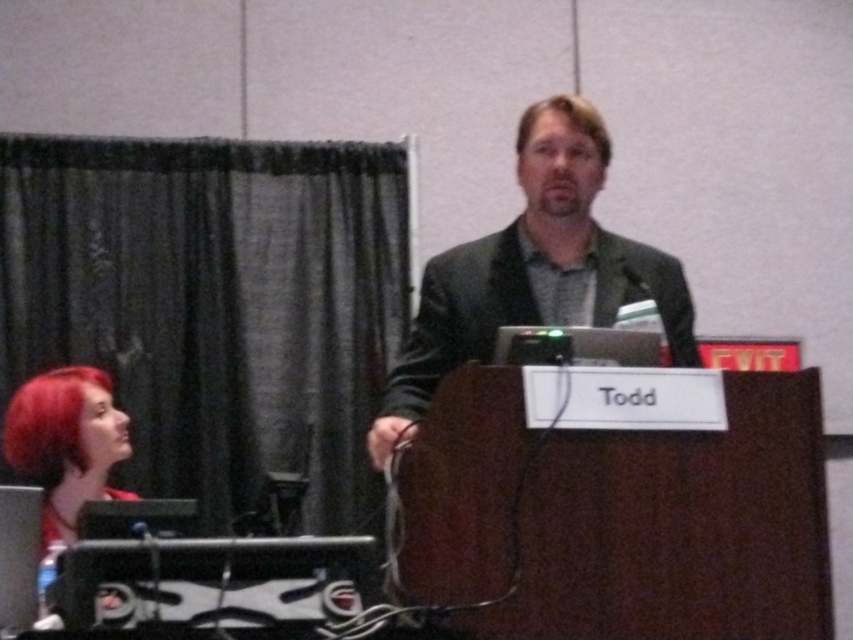
Is dark gray suit at center above blonde hair at center?

No.

Is dark gray suit at center thinner than blonde hair at center?

No.

Describe the element at coordinates (532, 269) in the screenshot. I see `dark gray suit at center` at that location.

Find the location of `dark gray suit at center`. dark gray suit at center is located at coordinates (532, 269).

Is point (549, 115) positioned behind point (64, 380)?

No, it is in front of (64, 380).

At what (x,y) coordinates should I click in order to perform the action: click on dark gray suit at center. Please return your answer as a coordinate pair (x, y). The height and width of the screenshot is (640, 853). Looking at the image, I should click on (532, 269).

Which is more to the left, shiny red hair at lower left or blonde hair at center?

shiny red hair at lower left

Is point (45, 404) farther from viewer compared to point (532, 124)?

Yes.

Where is `shiny red hair at lower left`? shiny red hair at lower left is located at coordinates (67, 444).